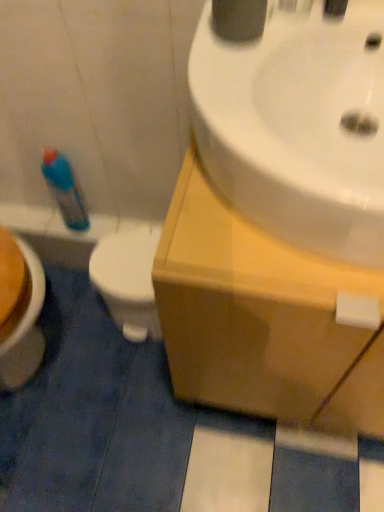
Where is `vacant space positioned to the left of blue plastic spray bottle at left`? Image resolution: width=384 pixels, height=512 pixels. vacant space positioned to the left of blue plastic spray bottle at left is located at coordinates (32, 220).